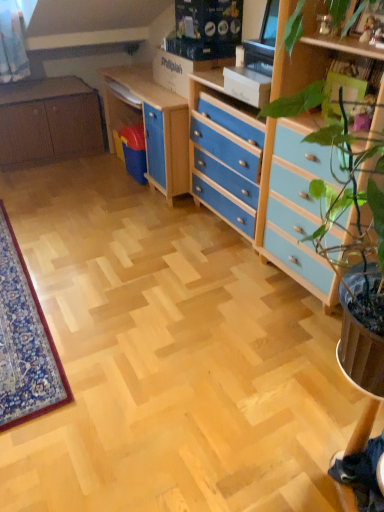
Question: From the image's perspective, is matte brown cabinet at left located above or below blue painted wood chest of drawers at center right?

Choices:
 (A) below
 (B) above

Answer: (B)

Question: Based on their sizes in the image, would you say matte brown cabinet at left is bigger or smaller than blue painted wood chest of drawers at center right?

Choices:
 (A) small
 (B) big

Answer: (B)

Question: Based on their relative distances, which object is nearer to the matte wood computer desk at center?

Choices:
 (A) blue painted wood chest of drawers at center right
 (B) matte brown cabinet at left

Answer: (A)

Question: Which of these objects is positioned farthest from the matte brown cabinet at left?

Choices:
 (A) blue painted wood chest of drawers at center right
 (B) matte wood computer desk at center

Answer: (B)